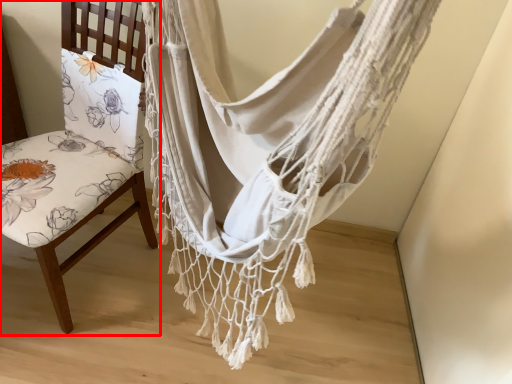
Question: From the image's perspective, where is chair (annotated by the red box) located in relation to curtain in the image?

Choices:
 (A) above
 (B) below

Answer: (A)